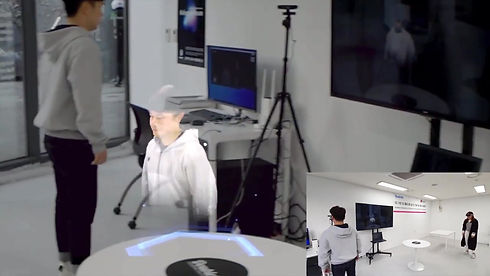
Where is `right chair wheel`? right chair wheel is located at coordinates (132, 224).